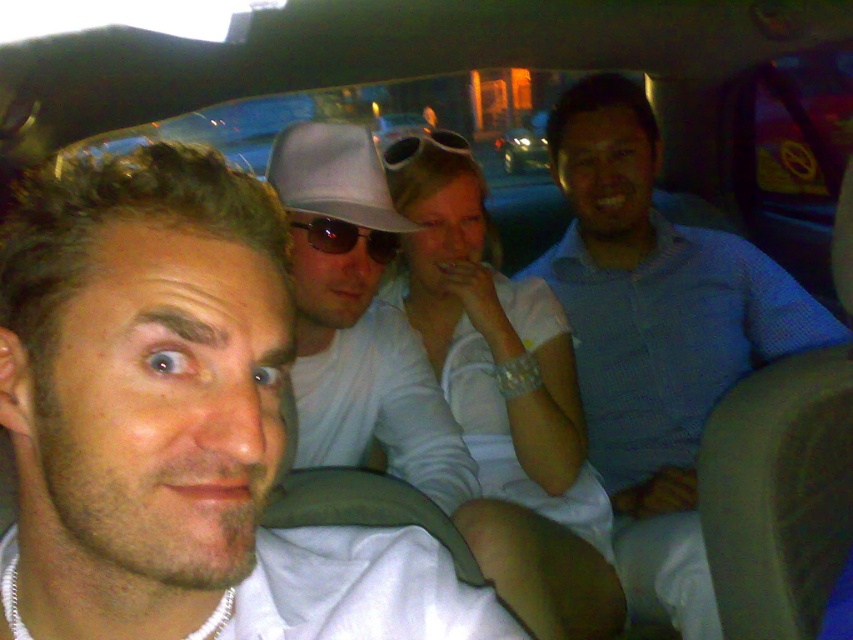
Question: Can you confirm if smooth white shirt at center is bigger than clear plastic goggles at center?

Choices:
 (A) no
 (B) yes

Answer: (B)

Question: Is white matte shirt at center to the left of sunglasses at center from the viewer's perspective?

Choices:
 (A) no
 (B) yes

Answer: (A)

Question: Which of these objects is positioned farthest from the blue textured shirt at center?

Choices:
 (A) green matte car at center
 (B) sunglasses at center

Answer: (A)

Question: Which point appears farthest from the camera in this image?

Choices:
 (A) (680, 506)
 (B) (560, 371)

Answer: (A)

Question: Considering the real-world distances, which object is farthest from the blue textured shirt at center?

Choices:
 (A) sunglasses at center
 (B) clear plastic goggles at center

Answer: (A)

Question: Is smooth white shirt at center in front of matte white baseball hat at center?

Choices:
 (A) no
 (B) yes

Answer: (B)